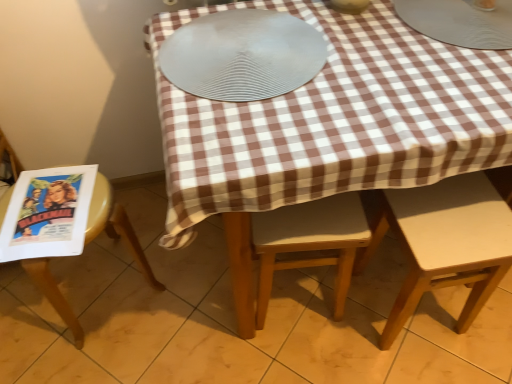
At what (x,y) coordinates should I click in order to perform the action: click on vacant region under white matte chair at lower right, marked as the 3th chair in a left-to-right arrangement (from a real-world perspective). Please return your answer as a coordinate pair (x, y). Looking at the image, I should click on (392, 299).